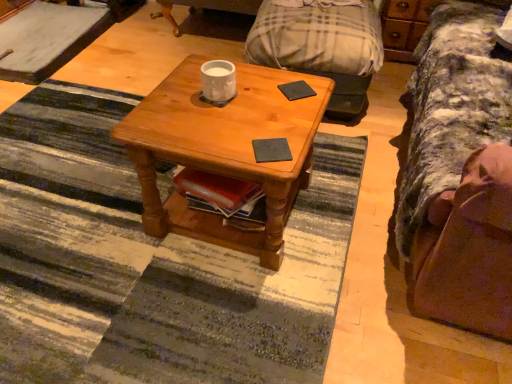
Find the location of a particular element. This screenshot has width=512, height=384. vacant point to the right of white glossy mug at center is located at coordinates (270, 100).